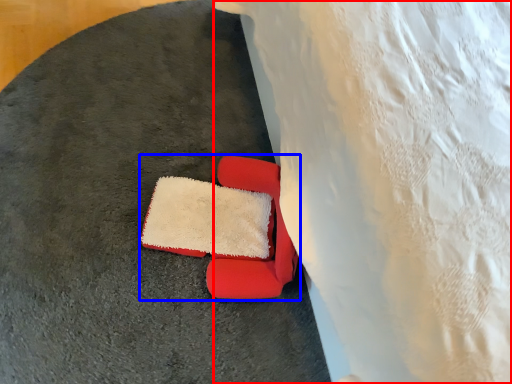
Question: Which point is closer to the camera, sheet (highlighted by a red box) or chair (highlighted by a blue box)?

Choices:
 (A) sheet
 (B) chair

Answer: (A)